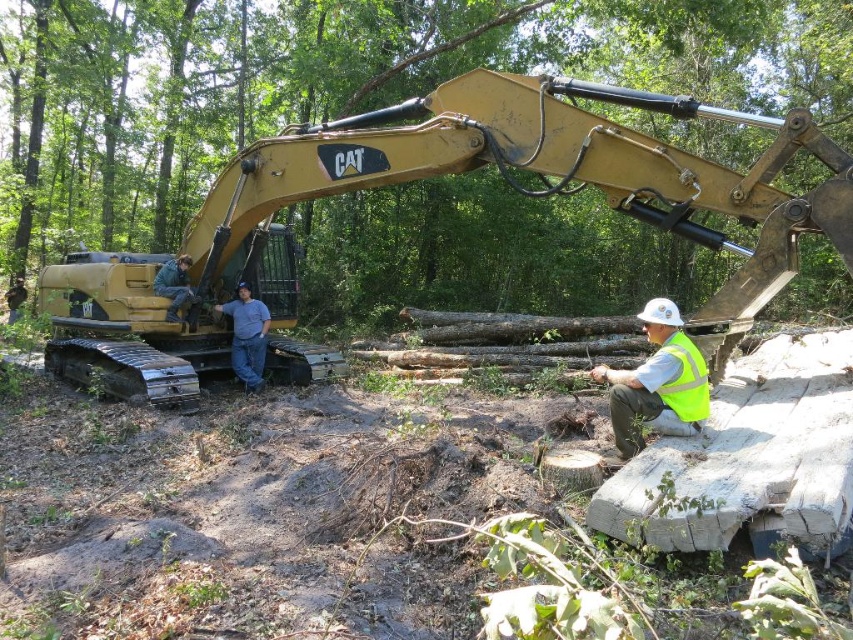
Is yellow reflective vest at lower right to the left of brushed metal helmet at left from the viewer's perspective?

Incorrect, yellow reflective vest at lower right is not on the left side of brushed metal helmet at left.

Does yellow reflective vest at lower right have a lesser width compared to brushed metal helmet at left?

No.

Is point (650, 396) positioned before point (164, 284)?

Yes.

Find the location of `yellow reflective vest at lower right`. yellow reflective vest at lower right is located at coordinates (657, 384).

Between gold metallic excavator at left and high-visibility fabric safety vest at lower right, which one appears on the left side from the viewer's perspective?

gold metallic excavator at left is more to the left.

Who is positioned more to the right, gold metallic excavator at left or high-visibility fabric safety vest at lower right?

high-visibility fabric safety vest at lower right is more to the right.

The width and height of the screenshot is (853, 640). In order to click on gold metallic excavator at left in this screenshot , I will do click(x=428, y=177).

Is point (329, 364) closer to camera compared to point (173, 266)?

No, (329, 364) is behind (173, 266).

Between gold metallic excavator at left and brushed metal helmet at left, which one appears on the left side from the viewer's perspective?

brushed metal helmet at left

Between point (647, 202) and point (177, 284), which one is positioned behind?

Positioned behind is point (177, 284).

The width and height of the screenshot is (853, 640). What are the coordinates of `gold metallic excavator at left` in the screenshot? It's located at (428, 177).